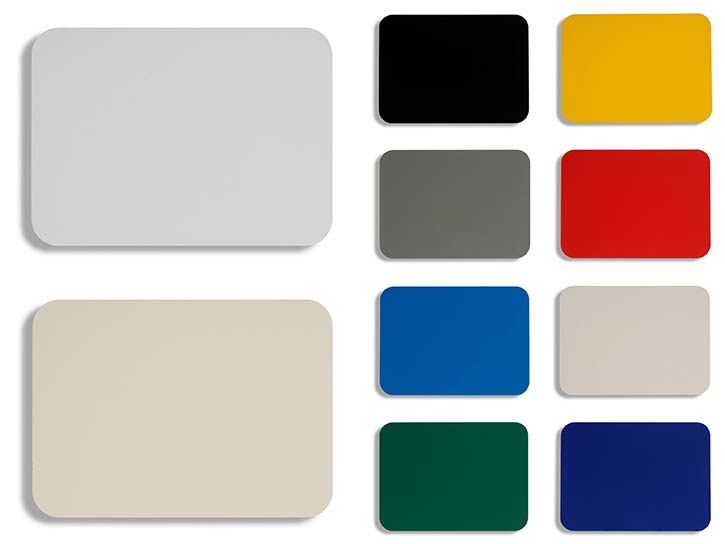
In order to click on space between red tile and dark grey tile in this screenshot , I will do `click(542, 205)`.